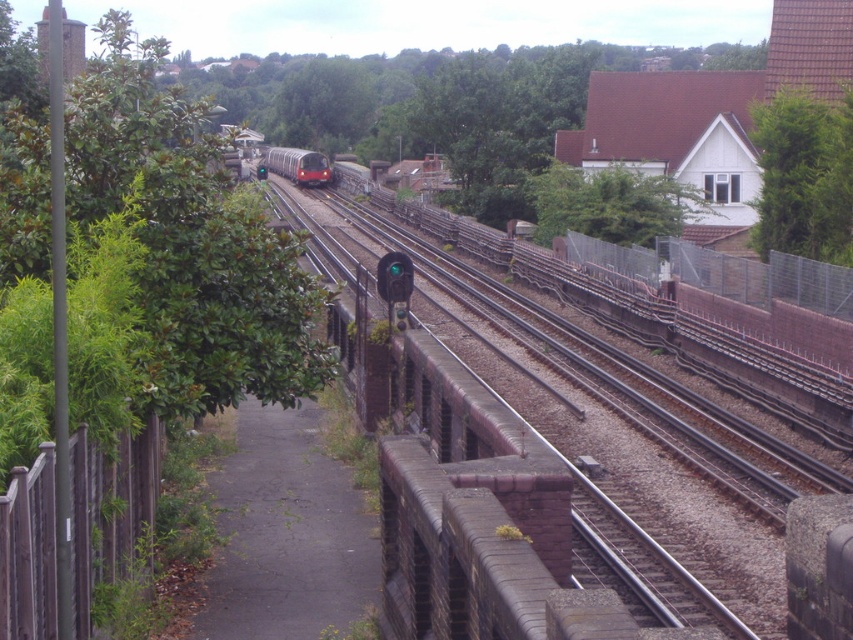
You are standing on the pedestrian walkway and want to cross the railway tracks safely. The safe distance required to cross before a train arrives is 5 meters. Given the distance of the smooth metal train track at center from you, can you safely cross the tracks before the approaching train arrives?

The smooth metal train track at center is 4.34 meters away from the viewer. Since the required safe distance is 5 meters, you cannot safely cross the tracks before the approaching train arrives because the distance is less than the required safety margin.

You are standing on the elevated walkway and want to estimate how far the smooth metal train track at center is from your current position. Based on the image, can you provide an approximate distance?

The smooth metal train track at center is approximately 14.24 feet away from the camera, so your current position on the elevated walkway is about 14.24 feet away from the smooth metal train track at center.